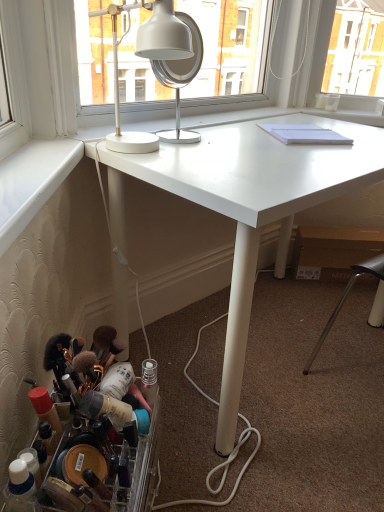
Identify the location of free space in front of white metallic mirror at upper center. tap(197, 156).